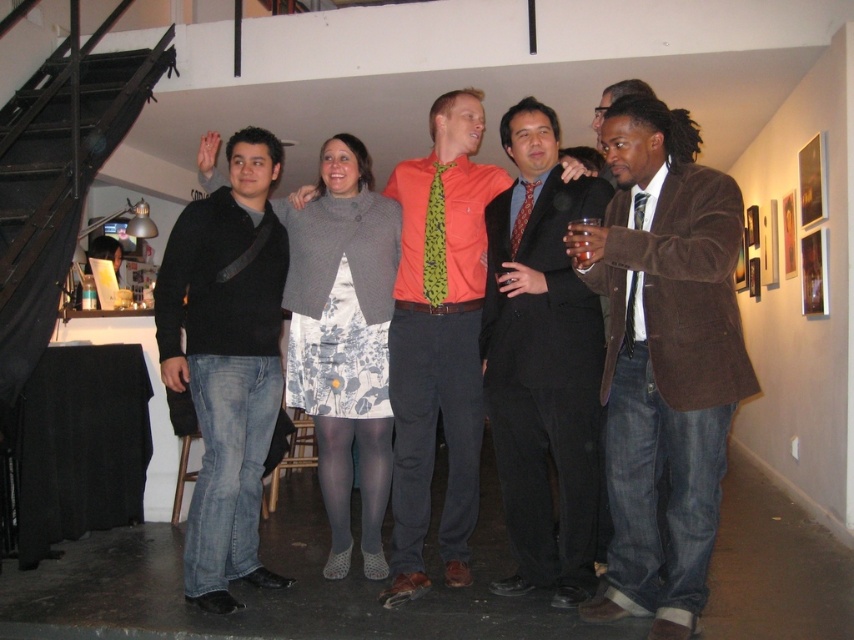
You are standing in front of the group and want to locate the green leafy fabric tie at center. What are its coordinates?

The green leafy fabric tie at center is located at coordinates point [436,241].

You are organizing a formal event and need to choose between the green leafy fabric tie at center and the red patterned tie at center based on their widths. Which tie should you select if you prefer a wider option?

The red patterned tie at center is wider than the green leafy fabric tie at center, so you should choose the red patterned tie at center for a wider option.

You are a photographer trying to adjust the lighting for a group photo. You notice two ties in the image. Which tie is positioned lower in the frame between the green leafy fabric tie at center and the red patterned tie at center?

The green leafy fabric tie at center is located below the red patterned tie at center, so it is positioned lower in the frame.